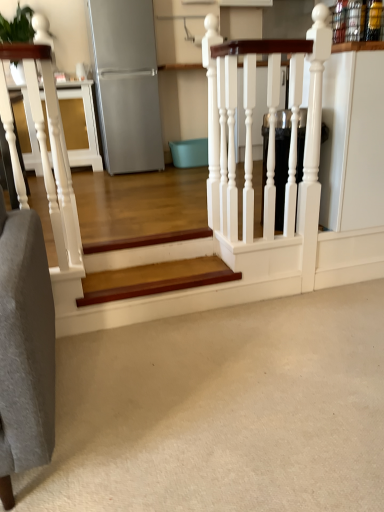
This screenshot has height=512, width=384. What are the coordinates of `empty space that is ontop of wooden stair at center` in the screenshot? It's located at (155, 274).